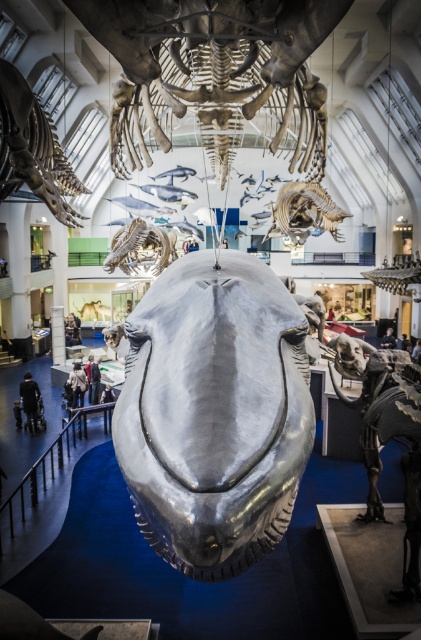
Consider the image. You are a visitor in the museum and want to take a photo of both the shiny metallic dinosaur at lower right and the dark blue fabric at lower center. Which object should you focus on first if you want to capture both in one frame without moving your camera?

The shiny metallic dinosaur at lower right is bigger than the dark blue fabric at lower center, so you should focus on the shiny metallic dinosaur at lower right first to ensure it fits properly in the frame, then adjust to include the smaller dark blue fabric at lower center.

You are standing in the museum and notice two points marked on the whale sculpture. The first point is at coordinates point (405,525) and the second is at point (383,340). Which point is closer to your eyes?

Point (405,525) is closer to the viewer than point (383,340).